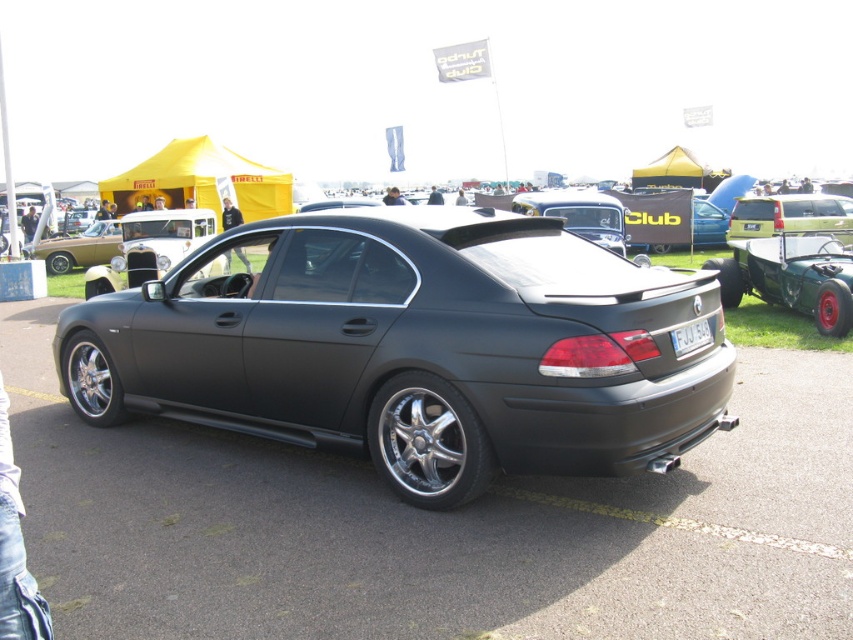
Between point (296, 371) and point (808, 230), which one is positioned in front?

Point (296, 371) is more forward.

Which of these two, matte black car at center or matte black car at right, stands shorter?

Standing shorter between the two is matte black car at right.

Based on the photo, who is more forward, (505, 408) or (846, 236)?

Point (505, 408) is in front.

The width and height of the screenshot is (853, 640). Find the location of `matte black car at center`. matte black car at center is located at coordinates (415, 348).

Can you confirm if matte black car at right is thinner than white matte license plate at rear?

No.

The width and height of the screenshot is (853, 640). Find the location of `matte black car at right`. matte black car at right is located at coordinates (792, 216).

Can you confirm if matte black car at left is shorter than white matte license plate at rear?

No.

Locate an element on the screen. This screenshot has width=853, height=640. matte black car at left is located at coordinates (80, 248).